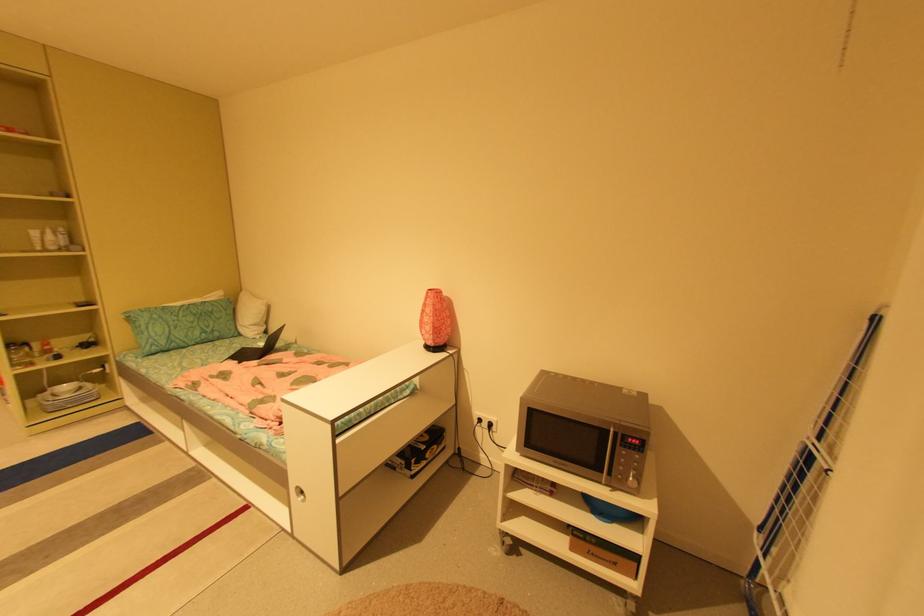
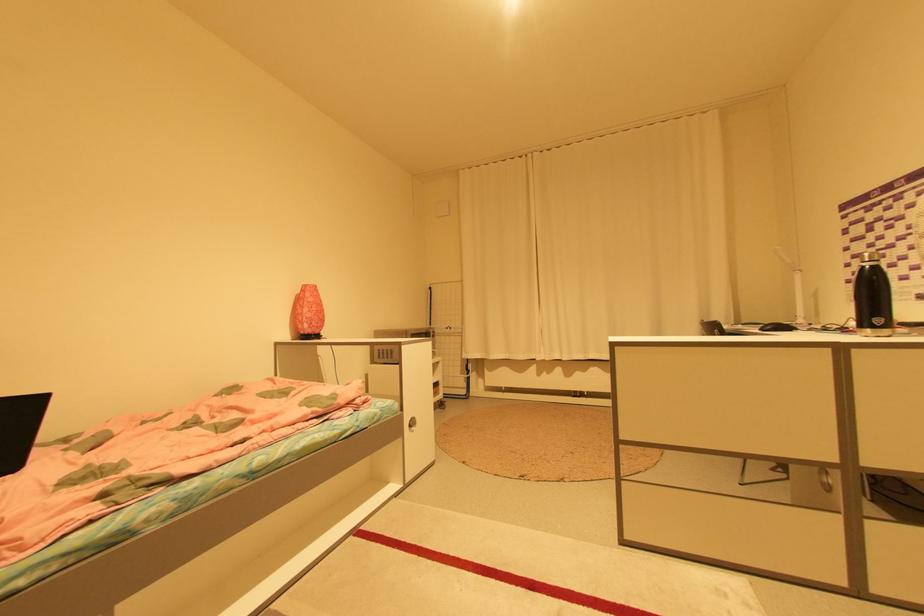
Find the pixel in the second image that matches the point at 436,290 in the first image.

(311, 285)